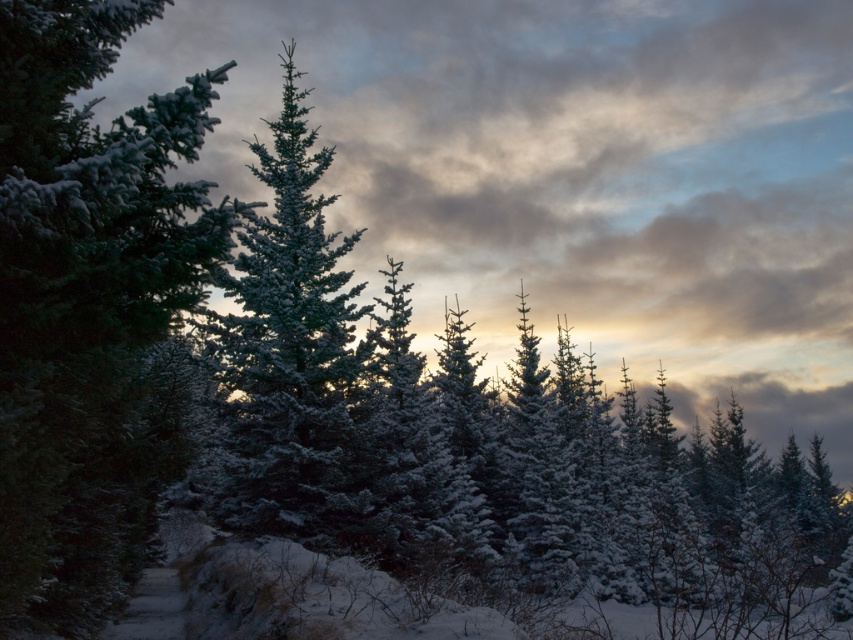
Which is more to the right, snow-covered evergreen at left or snow-covered evergreen at center?

Positioned to the right is snow-covered evergreen at left.

Is snow-covered evergreen at left behind snow-covered evergreen at center?

No, it is in front of snow-covered evergreen at center.

Does point (131, 200) come closer to viewer compared to point (323, 422)?

Yes.

Locate an element on the screen. The height and width of the screenshot is (640, 853). snow-covered evergreen at left is located at coordinates tap(91, 308).